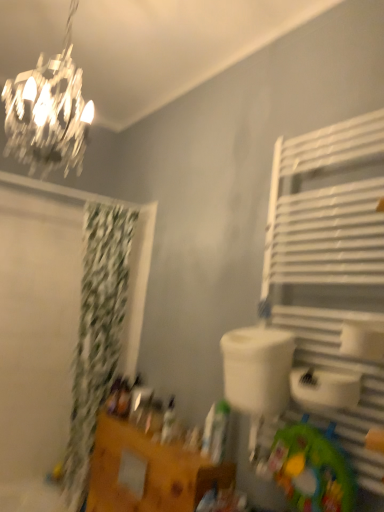
What is the approximate width of white metal towel rack at right?

white metal towel rack at right is 2.49 inches wide.

You are a GUI agent. You are given a task and a screenshot of the screen. Output one action in this format:
    pyautogui.click(x=<x>, y=<y>)
    Task: Click on the shiny crystal chandelier at upper left
    
    Given the screenshot: What is the action you would take?
    pyautogui.click(x=48, y=112)

Describe the element at coordinates (257, 369) in the screenshot. I see `white plastic sink at center` at that location.

Image resolution: width=384 pixels, height=512 pixels. What do you see at coordinates (148, 472) in the screenshot? I see `wooden vanity at lower left` at bounding box center [148, 472].

Find the location of `green fabric shower curtain at left`. green fabric shower curtain at left is located at coordinates (97, 335).

At what (x,y) coordinates should I click in order to perform the action: click on green fabric mat at lower right. Please return your answer as a coordinate pair (x, y). This screenshot has width=384, height=512. Looking at the image, I should click on (311, 470).

In the scene shown: Can you confirm if green fabric mat at lower right is shorter than white metal towel rack at right?

Yes, green fabric mat at lower right is shorter than white metal towel rack at right.

Is green fabric mat at lower right to the right of white metal towel rack at right from the viewer's perspective?

No, green fabric mat at lower right is not to the right of white metal towel rack at right.

This screenshot has height=512, width=384. Find the location of `shelf above the green fabric mat at lower right (from a real-world perspective)`. shelf above the green fabric mat at lower right (from a real-world perspective) is located at coordinates (331, 266).

Would you consider green fabric mat at lower right to be distant from white metal towel rack at right?

Actually, green fabric mat at lower right and white metal towel rack at right are a little close together.

Is wooden vanity at lower left turned away from green fabric shower curtain at left?

No, wooden vanity at lower left is not facing away from green fabric shower curtain at left.

Which is further, (193, 464) or (87, 312)?

Point (87, 312)

Which of these two, wooden vanity at lower left or green fabric shower curtain at left, stands shorter?

wooden vanity at lower left.

Which object is positioned more to the right, shiny crystal chandelier at upper left or white metal towel rack at right?

white metal towel rack at right.

Is shiny crystal chandelier at upper left turned away from white metal towel rack at right?

No, shiny crystal chandelier at upper left is not facing the opposite direction of white metal towel rack at right.

Considering the sizes of shiny crystal chandelier at upper left and white metal towel rack at right in the image, is shiny crystal chandelier at upper left taller or shorter than white metal towel rack at right?

Considering their sizes, shiny crystal chandelier at upper left has less height than white metal towel rack at right.

Looking at this image, is shiny crystal chandelier at upper left behind white metal towel rack at right?

Yes, shiny crystal chandelier at upper left is further from the camera.

Does white plastic sink at center have a lesser width compared to green fabric mat at lower right?

Incorrect, the width of white plastic sink at center is not less than that of green fabric mat at lower right.

From a real-world perspective, who is located higher, white plastic sink at center or green fabric mat at lower right?

white plastic sink at center, from a real-world perspective.

Is white plastic sink at center aimed at green fabric mat at lower right?

No, white plastic sink at center is not aimed at green fabric mat at lower right.

Does green fabric shower curtain at left have a smaller size compared to shiny crystal chandelier at upper left?

No, green fabric shower curtain at left is not smaller than shiny crystal chandelier at upper left.

Is green fabric shower curtain at left at the left side of shiny crystal chandelier at upper left?

Yes.

Is green fabric shower curtain at left positioned far away from shiny crystal chandelier at upper left?

No, green fabric shower curtain at left is in close proximity to shiny crystal chandelier at upper left.

How different are the orientations of green fabric shower curtain at left and shiny crystal chandelier at upper left in degrees?

They differ by 6.8 degrees in their facing directions.

Between wooden vanity at lower left and green fabric mat at lower right, which one has more height?

Standing taller between the two is wooden vanity at lower left.

How many degrees apart are the facing directions of wooden vanity at lower left and green fabric mat at lower right?

The angle between the facing direction of wooden vanity at lower left and the facing direction of green fabric mat at lower right is 6.2 degrees.

Is wooden vanity at lower left far from green fabric mat at lower right?

Actually, wooden vanity at lower left and green fabric mat at lower right are a little close together.

Does wooden vanity at lower left have a larger size compared to green fabric mat at lower right?

Yes, wooden vanity at lower left is bigger than green fabric mat at lower right.

Between green fabric shower curtain at left and white plastic sink at center, which one appears on the left side from the viewer's perspective?

From the viewer's perspective, green fabric shower curtain at left appears more on the left side.

Can you confirm if green fabric shower curtain at left is taller than white plastic sink at center?

Correct, green fabric shower curtain at left is much taller as white plastic sink at center.

Where is `toy below the white metal towel rack at right (from the image's perspective)`? toy below the white metal towel rack at right (from the image's perspective) is located at coordinates (311, 470).

Find the location of `shower curtain that is on the left side of wooden vanity at lower left`. shower curtain that is on the left side of wooden vanity at lower left is located at coordinates (97, 335).

Looking at the image, which one is located further to wooden vanity at lower left, white plastic sink at center or green fabric mat at lower right?

Based on the image, white plastic sink at center appears to be further to wooden vanity at lower left.

Looking at the image, which one is located closer to green fabric mat at lower right, green fabric shower curtain at left or white metal towel rack at right?

white metal towel rack at right is closer to green fabric mat at lower right.

Looking at the image, which one is located further to green fabric shower curtain at left, green fabric mat at lower right or wooden vanity at lower left?

Based on the image, green fabric mat at lower right appears to be further to green fabric shower curtain at left.

Which object lies further to the anchor point white metal towel rack at right, white plastic sink at center or wooden vanity at lower left?

wooden vanity at lower left lies further to white metal towel rack at right than the other object.

Which object lies nearer to the anchor point green fabric mat at lower right, white plastic sink at center or shiny crystal chandelier at upper left?

white plastic sink at center is positioned closer to the anchor green fabric mat at lower right.

From the image, which object appears to be farther from green fabric shower curtain at left, white metal towel rack at right or wooden vanity at lower left?

Based on the image, white metal towel rack at right appears to be further to green fabric shower curtain at left.

Considering their positions, is white metal towel rack at right positioned closer to white plastic sink at center than green fabric shower curtain at left?

white metal towel rack at right.

Estimate the real-world distances between objects in this image. Which object is closer to green fabric shower curtain at left, white metal towel rack at right or white plastic sink at center?

white plastic sink at center is closer to green fabric shower curtain at left.

Find the location of a particular element. sink situated between green fabric shower curtain at left and white metal towel rack at right from left to right is located at coordinates (257, 369).

The height and width of the screenshot is (512, 384). What are the coordinates of `shelf between shiny crystal chandelier at upper left and wooden vanity at lower left from top to bottom` in the screenshot? It's located at (331, 266).

I want to click on shelf between shiny crystal chandelier at upper left and white plastic sink at center vertically, so click(x=331, y=266).

The width and height of the screenshot is (384, 512). I want to click on sink between white metal towel rack at right and wooden vanity at lower left in the up-down direction, so click(x=257, y=369).